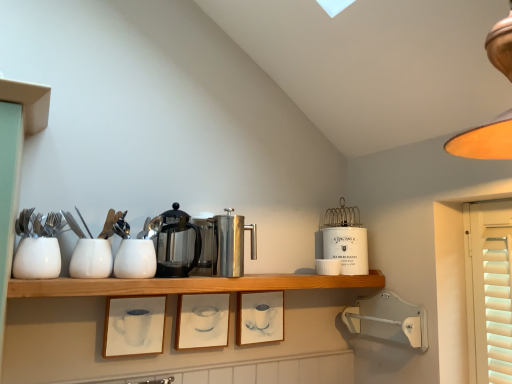
This screenshot has height=384, width=512. What are the coordinates of `vacant area that is in front of white glossy cup at center, marked as the third tableware in a back-to-front arrangement` in the screenshot? It's located at (72, 278).